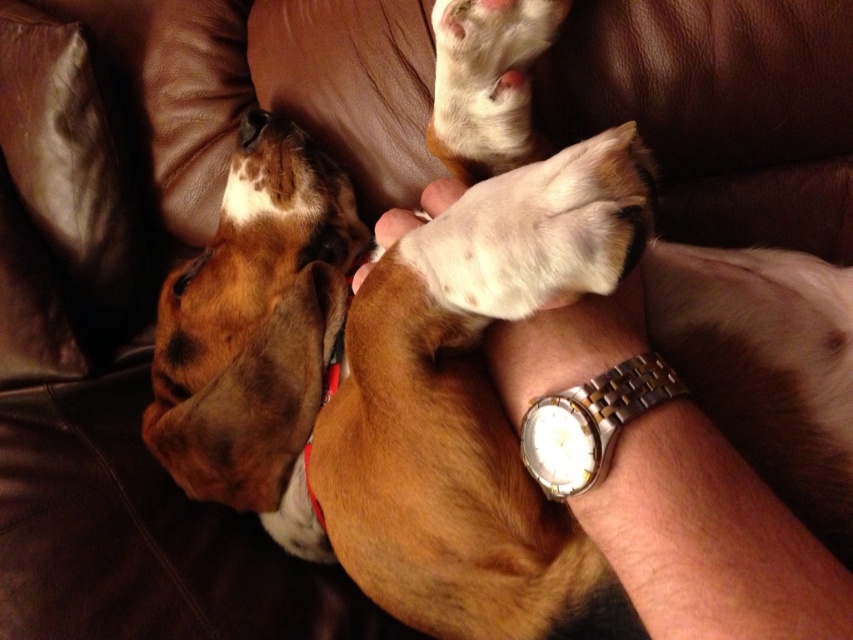
Can you confirm if gold/steel watch at center is smaller than brown fur nose at upper center?

No.

Does gold/steel watch at center have a lesser height compared to brown fur nose at upper center?

Incorrect, gold/steel watch at center's height does not fall short of brown fur nose at upper center's.

Between point (555, 419) and point (251, 116), which one is positioned behind?

The point (251, 116) is more distant.

Where is `gold/steel watch at center`? This screenshot has width=853, height=640. gold/steel watch at center is located at coordinates (590, 422).

Is white fur paw at center positioned behind gold/steel watch at center?

No, it is in front of gold/steel watch at center.

Does white fur paw at center have a greater height compared to gold/steel watch at center?

Indeed, white fur paw at center has a greater height compared to gold/steel watch at center.

Is point (456, 296) positioned in front of point (573, 420)?

No, (456, 296) is behind (573, 420).

Locate an element on the screen. The width and height of the screenshot is (853, 640). white fur paw at center is located at coordinates (537, 230).

Between white fur paw at center and white leather hand at center, which one is positioned lower?

white fur paw at center

Is white fur paw at center to the left of white leather hand at center from the viewer's perspective?

In fact, white fur paw at center is to the right of white leather hand at center.

The width and height of the screenshot is (853, 640). Find the location of `white fur paw at center`. white fur paw at center is located at coordinates (537, 230).